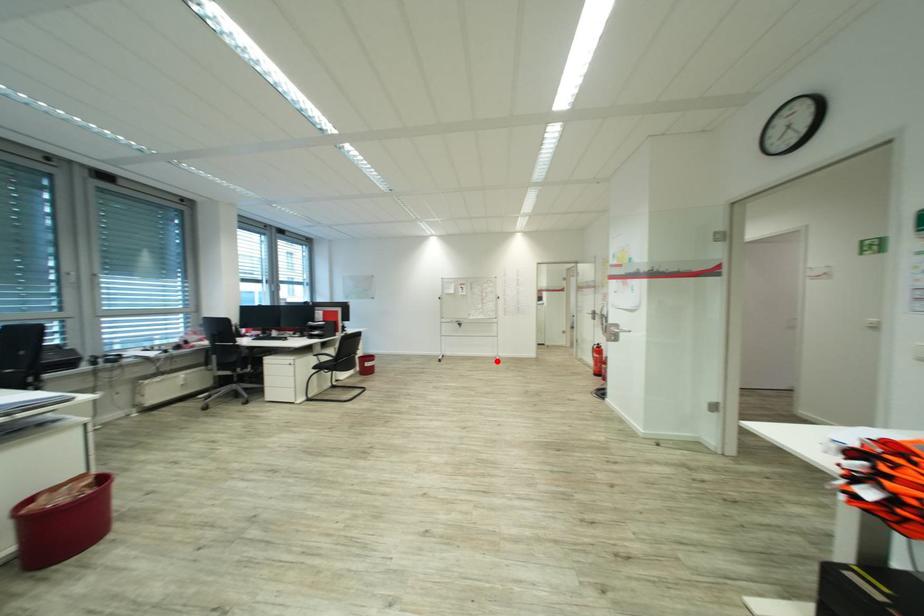
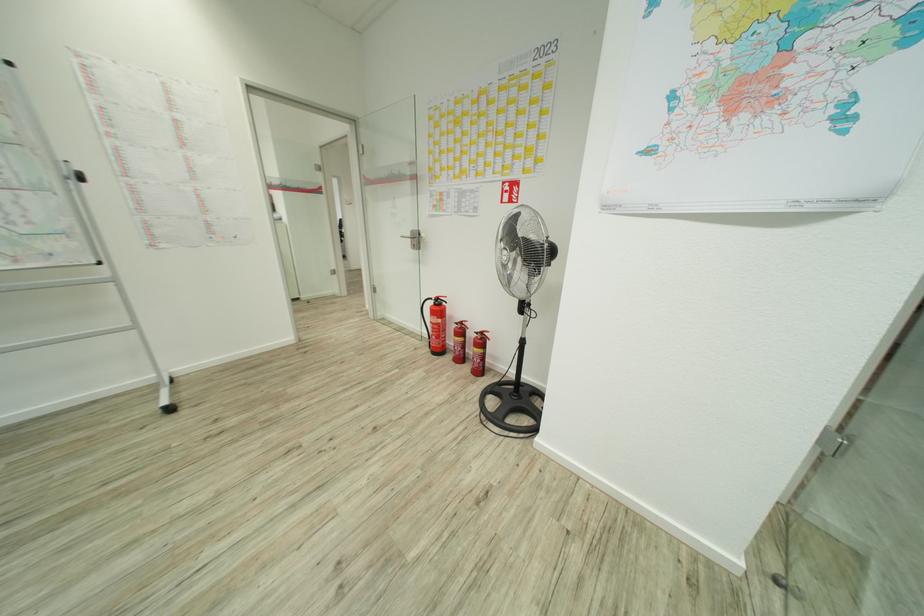
The point at the highlighted location is marked in the first image. Where is the corresponding point in the second image?

(169, 408)